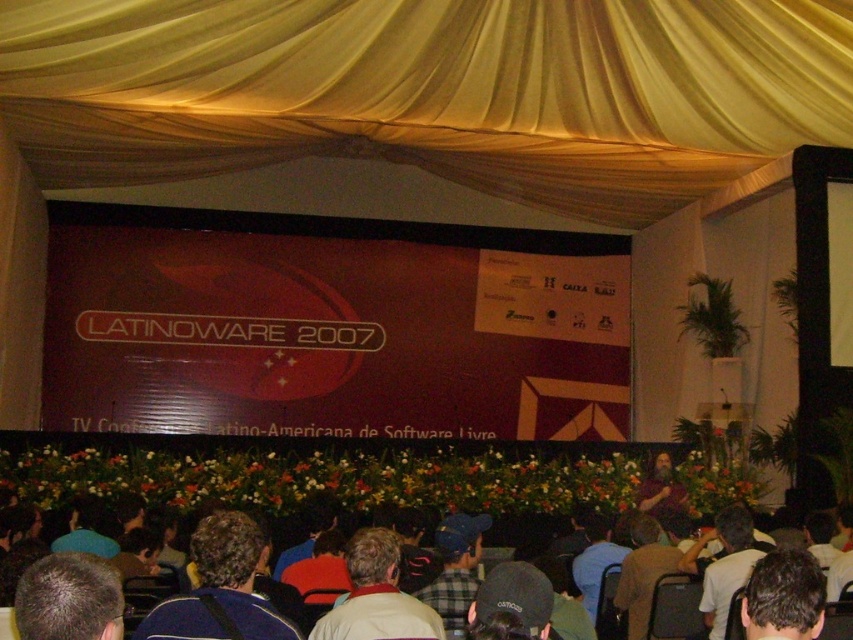
Question: Among these objects, which one is farthest from the camera?

Choices:
 (A) black fabric cap at lower center
 (B) dark brown hair at lower left

Answer: (A)

Question: In this image, where is blue fabric at lower left located relative to black fabric cap at lower center?

Choices:
 (A) above
 (B) below

Answer: (A)

Question: Is dark brown hair at lower left bigger than white fabric shirt at center?

Choices:
 (A) no
 (B) yes

Answer: (A)

Question: In this image, where is plaid fabric shirt at center located relative to light blue shirt at center?

Choices:
 (A) above
 (B) below

Answer: (A)

Question: Which object is farther from the camera taking this photo?

Choices:
 (A) brown matte projection screen at center
 (B) light blue shirt at center
 (C) dark brown hair at lower left

Answer: (A)

Question: Which object is positioned closest to the light blue shirt at center?

Choices:
 (A) black fabric cap at lower center
 (B) yellow fabric curtain at upper center
 (C) white fabric shirt at center

Answer: (A)